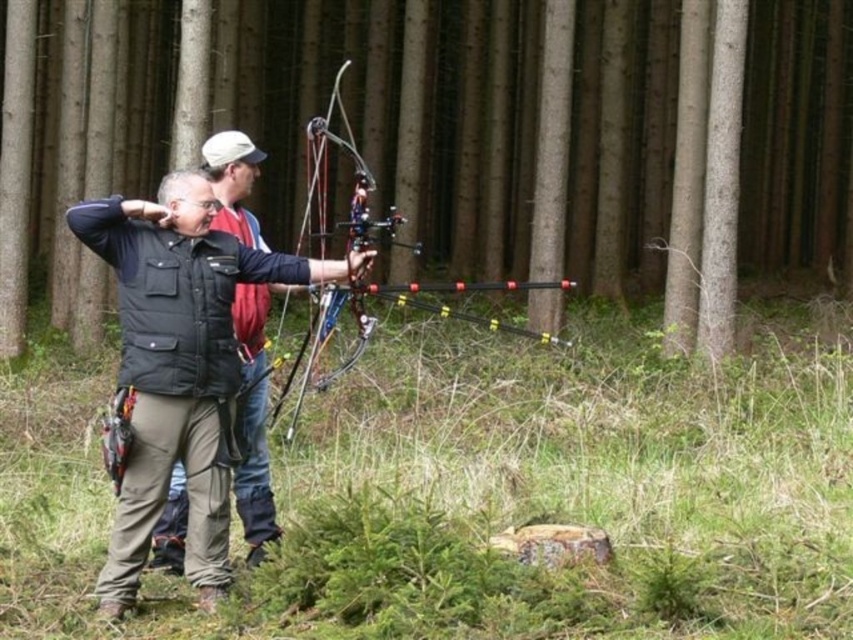
From the picture: You are standing in the forest and see the point at coordinates (827, 212). If you want to throw a pebble to hit that point, what is the minimum distance you need to throw it?

The point at coordinates (827, 212) is 23.36 meters away from you, so you need to throw the pebble at least 23.36 meters to reach it.

You are standing at the point marked as point (418, 298) in the forest. You want to walk 60 feet straight ahead. Will you exit the forest before reaching that distance?

The distance between point (418, 298) and the viewer is 59.46 feet. Since you want to walk 60 feet straight ahead, you will exit the forest before reaching the full 60 feet because the distance to the forest edge is less than 60 feet.